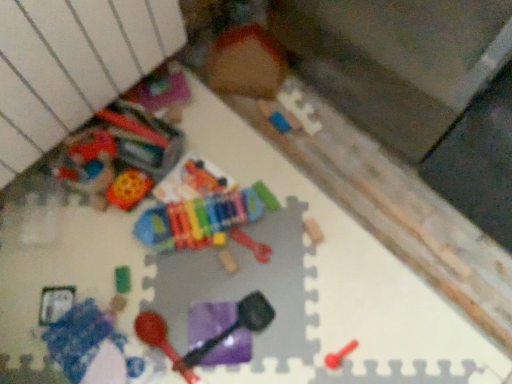
Identify the location of vacant area on top of multicolored plastic xylophone at center, the third toy from the left (from a real-world perspective). point(198,214).